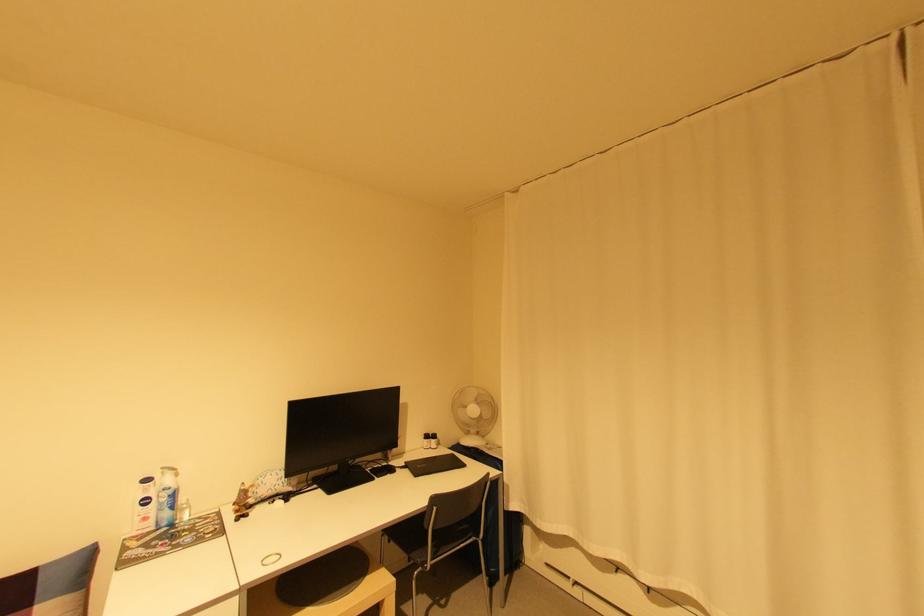
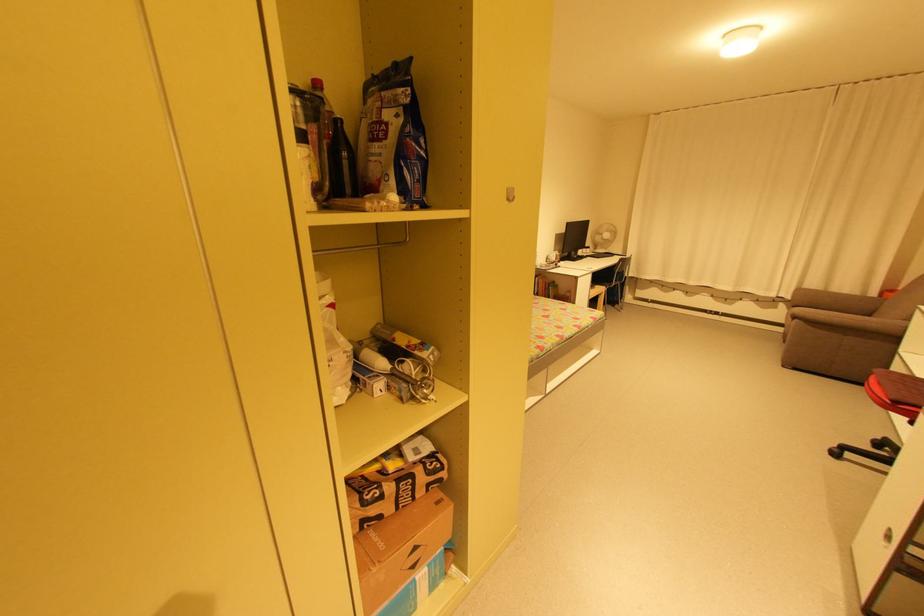
In the second image, find the point that corresponds to the point at 438,440 in the first image.

(592, 249)